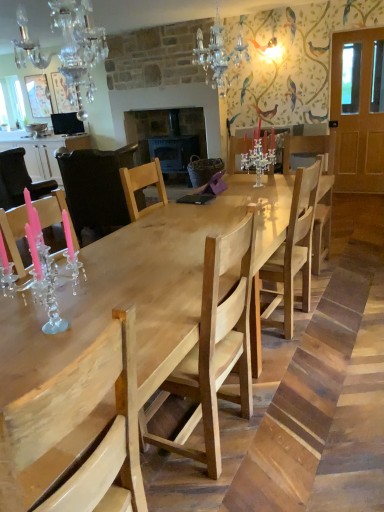
Question: Is crystal chandelier at upper center, placed as the 1th light fixture when sorted from right to left, taller or shorter than natural wood table at center?

Choices:
 (A) tall
 (B) short

Answer: (B)

Question: Is crystal chandelier at upper center, which ranks as the 1th light fixture in top-to-bottom order, inside or outside of natural wood table at center?

Choices:
 (A) inside
 (B) outside

Answer: (B)

Question: Estimate the real-world distances between objects in this image. Which object is closer to the crystal chandelier at upper center, marked as the second light fixture in a left-to-right arrangement?

Choices:
 (A) black leather chair at center, which appears as the 2th chair when viewed from the back
 (B) pink glossy candlestick at left, which ranks as the sixth chair in front-to-back order
 (C) natural wood table at center
 (D) natural wood chair at center, the 6th chair positioned from the back
 (E) light wood chair at center, placed as the 2th chair when sorted from front to back

Answer: (C)

Question: Estimate the real-world distances between objects in this image. Which object is farther from the natural wood table at center?

Choices:
 (A) pink glossy candlestick at left, which is the 1th chair in back-to-front order
 (B) black leather chair at center, arranged as the fifth chair when viewed from the front
 (C) white glossy cabinet at left
 (D) natural wood chair at center, acting as the first chair starting from the front
 (E) crystal chandelier at upper left, the 1th light fixture positioned from the left

Answer: (C)